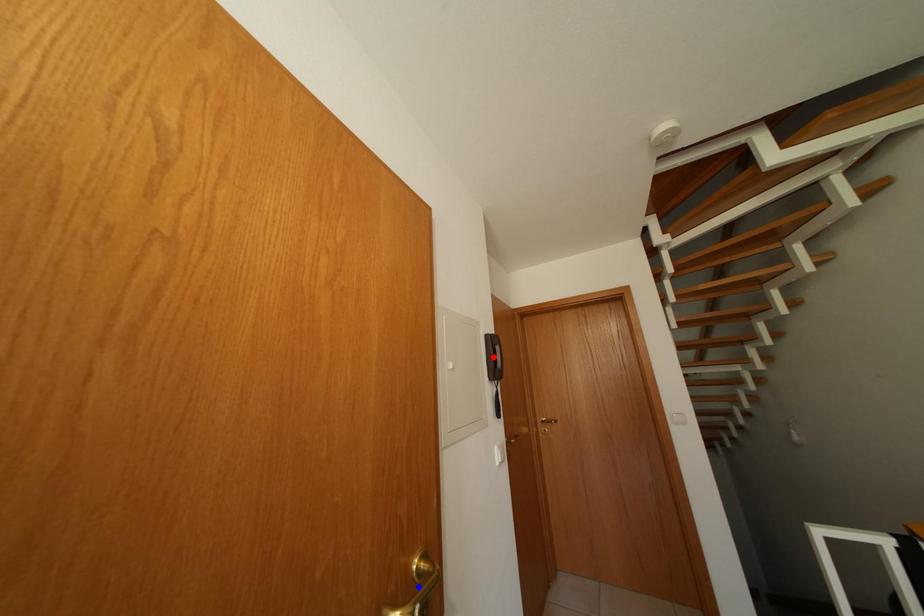
Question: Which of the two points in the image is closer to the camera?

Choices:
 (A) Blue point is closer.
 (B) Red point is closer.

Answer: (A)